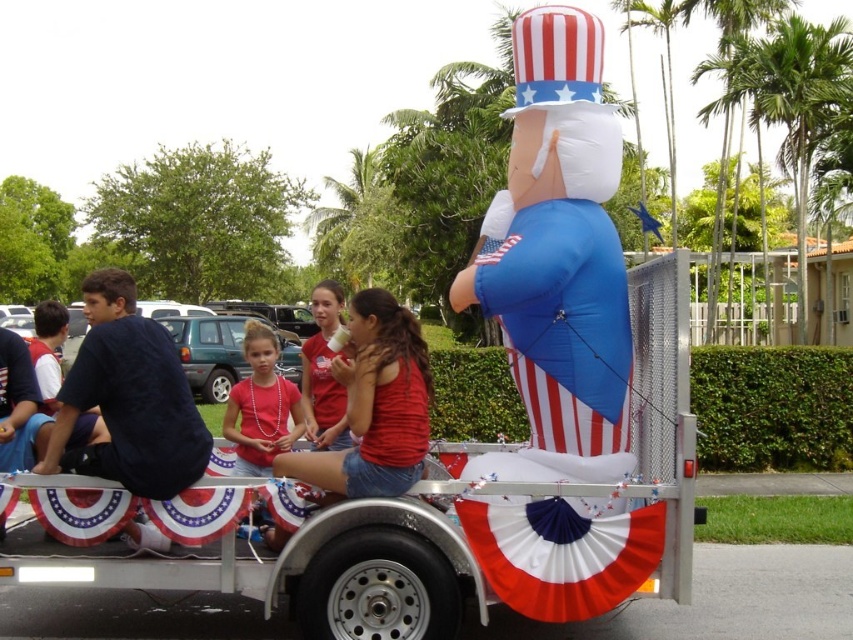
You are a photographer trying to capture the trailer and its decorations. You notice the red white and blue fabric at center and the dark blue fabric shirt at left. Which object is positioned closer to your camera lens?

The red white and blue fabric at center is closer to the viewer than the dark blue fabric shirt at left, so the red white and blue fabric at center would be closer to the camera lens.

You are a photographer trying to capture the inflatable Uncle Sam at center and the red white and blue fabric at center in the same frame. Based on their sizes, which object should you focus on first to ensure both are in the frame?

The inflatable uncle sam at center is taller than the red white and blue fabric at center, so you should focus on the inflatable uncle sam at center first to ensure both fit in the frame.